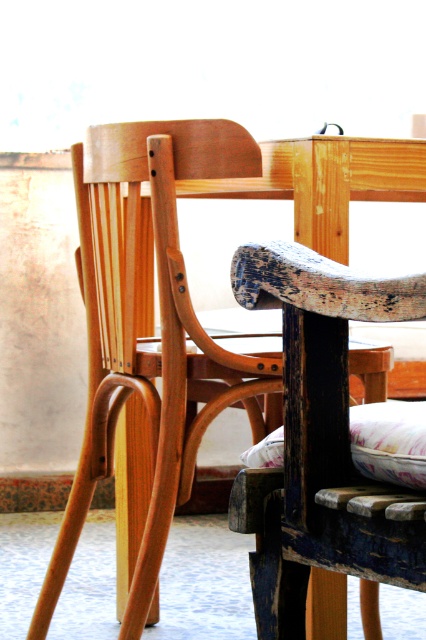
Question: In this image, where is natural wood chair at center located relative to floral fabric cushion at lower center?

Choices:
 (A) right
 (B) left

Answer: (B)

Question: Is natural wood chair at center further to the viewer compared to floral fabric cushion at lower center?

Choices:
 (A) yes
 (B) no

Answer: (A)

Question: Does natural wood chair at center appear on the left side of floral fabric cushion at lower center?

Choices:
 (A) yes
 (B) no

Answer: (A)